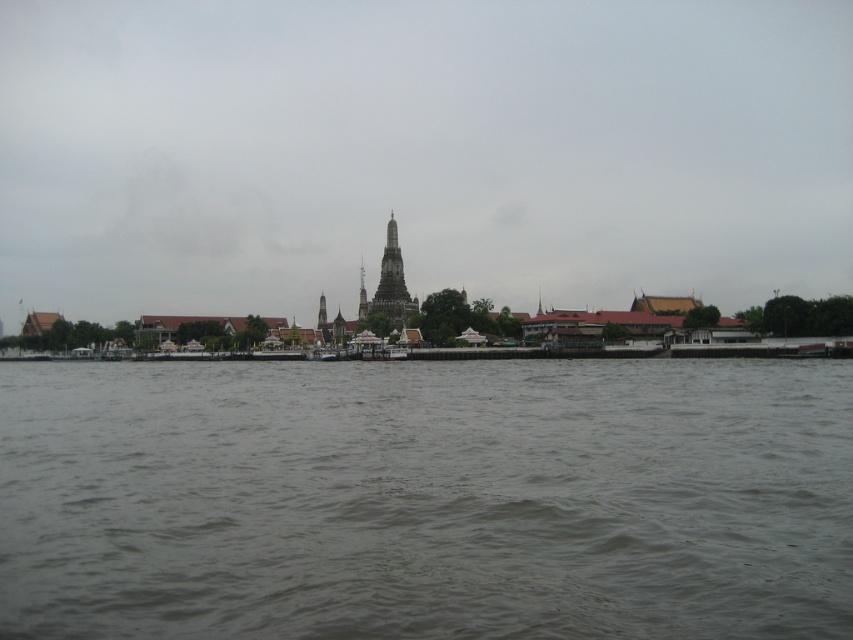
You are standing on the riverbank and see the transparent sky at center and the dark gray stone temple at center. Which object is above the other?

The transparent sky at center is located above the dark gray stone temple at center.

You are standing at the edge of the river and see two points marked on the water surface. The first point is at coordinates point (137,570) and the second is at point (363,296). Which point is closer to you?

Point (137,570) is in front of point (363,296), so the first point is closer to you.